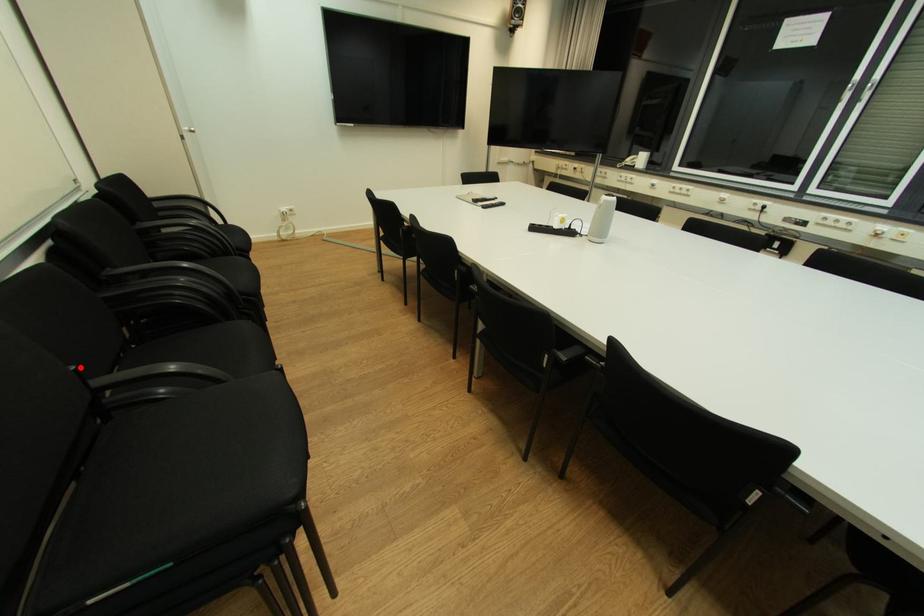
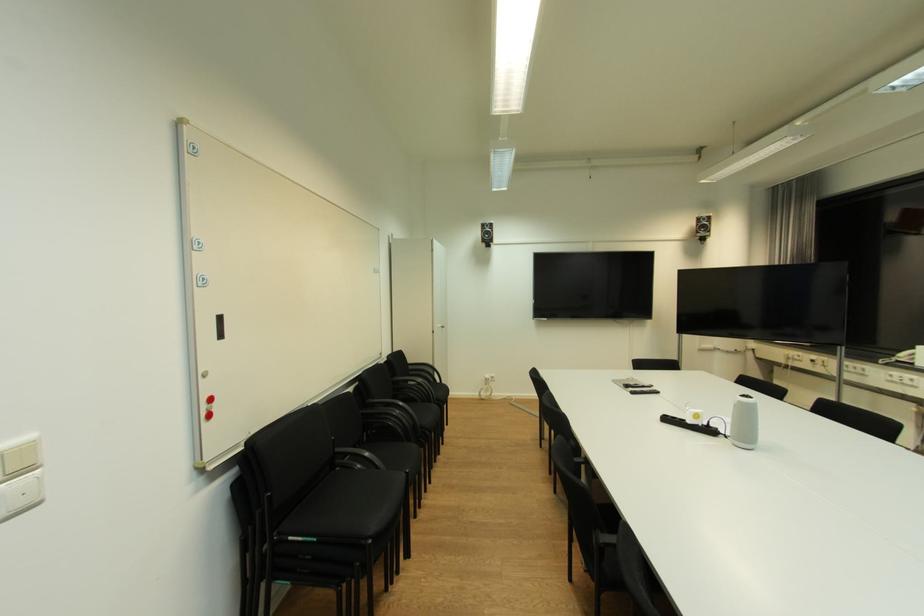
Question: I am providing you with two images of the same scene from different viewpoints. Image1 has a red point marked. In image2, the corresponding 3D location appears at what relative position? Reply with the corresponding letter.

Choices:
 (A) Closer
 (B) Farther

Answer: (A)